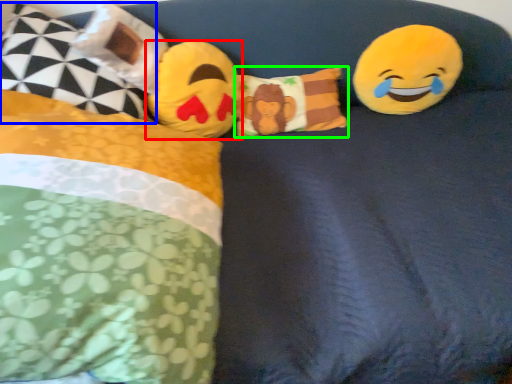
Question: Which is farther away from toy (highlighted by a red box)? pillow (highlighted by a blue box) or pillow (highlighted by a green box)?

Choices:
 (A) pillow
 (B) pillow

Answer: (A)